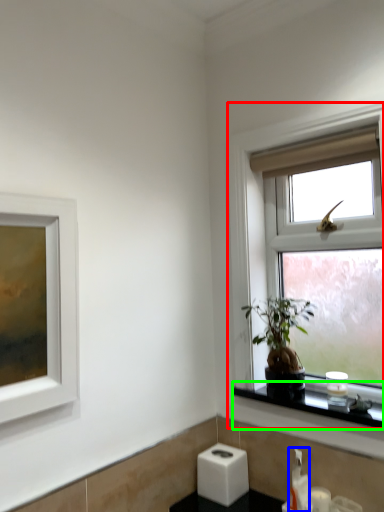
Question: Which is farther away from window (highlighted by a red box)? soap dispenser (highlighted by a blue box) or window sill (highlighted by a green box)?

Choices:
 (A) soap dispenser
 (B) window sill

Answer: (A)